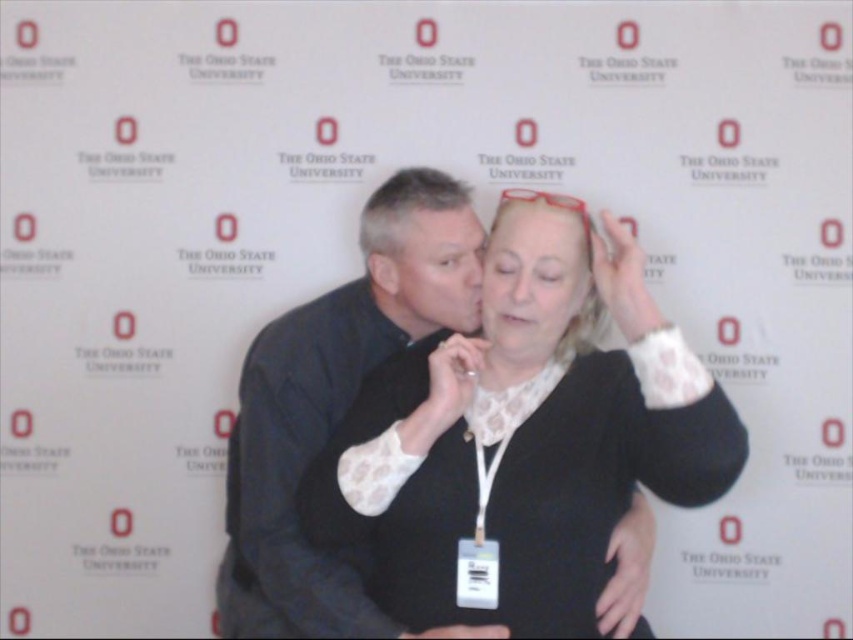
In the scene shown: Based on the scene description, can you determine which object is closer to the viewer between the matte black sweater at center and the translucent plastic forehead at upper center?

The matte black sweater at center is closer to the viewer than the translucent plastic forehead at upper center because it is positioned in front of it according to the description.

You are an AI analyzing a photo. The scene has two people near the Ohio State University backdrop. There is a point labeled as smooth skin face at center represented by point (543,244). Can you determine if this point is located on the face of the person on the left or the right?

The smooth skin face at center represented by point (543,244) is located on the face of the person on the left.

You are standing in front of the backdrop with the repeated Ohio State logos. You see a point at coordinates (x=521, y=440). What is located at that point?

The point at coordinates (x=521, y=440) indicates a matte black sweater at center.